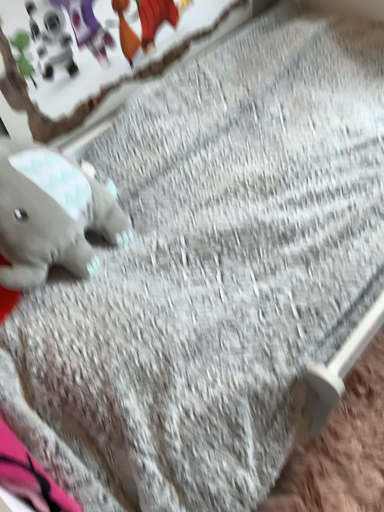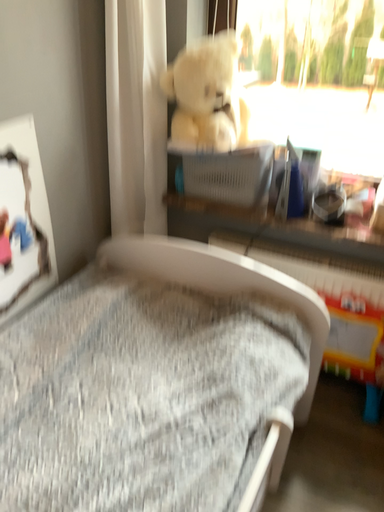
Question: How did the camera likely rotate when shooting the video?

Choices:
 (A) rotated upward
 (B) rotated downward

Answer: (A)